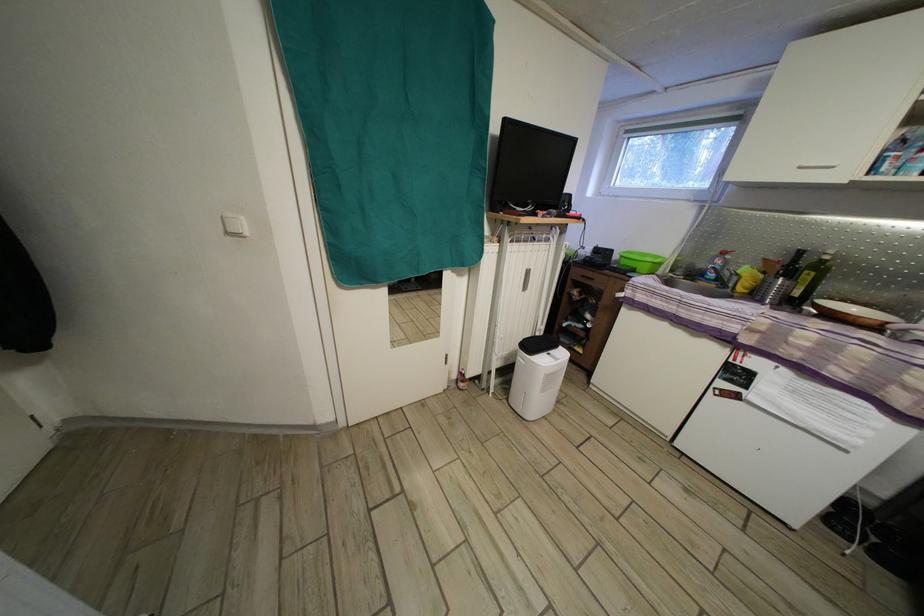
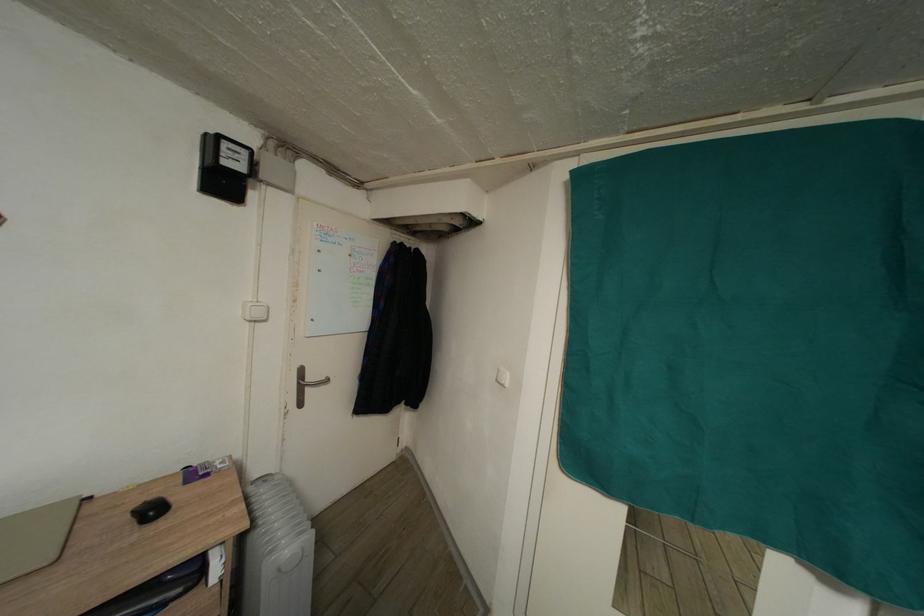
Question: How did the camera likely rotate?

Choices:
 (A) Left
 (B) Right
 (C) Up
 (D) Down

Answer: (A)